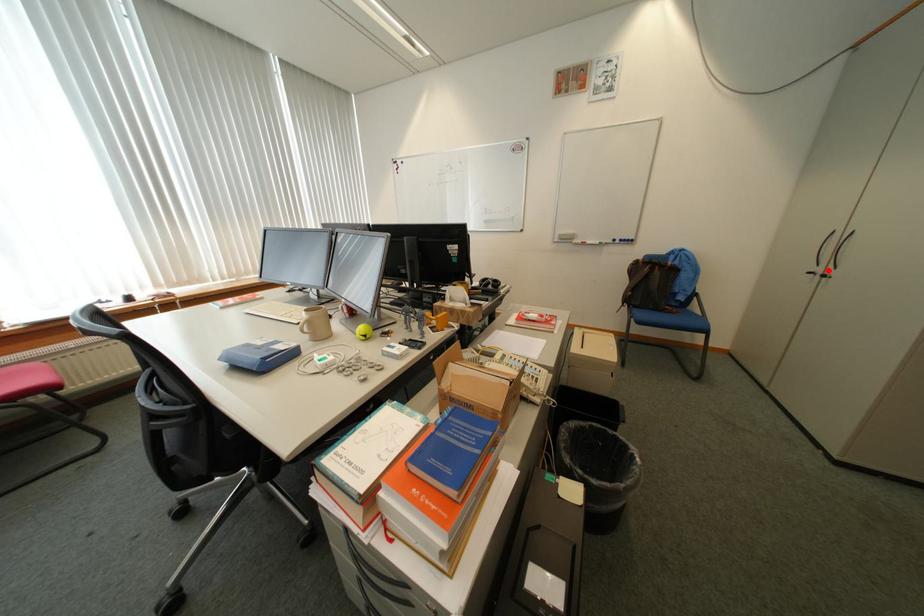
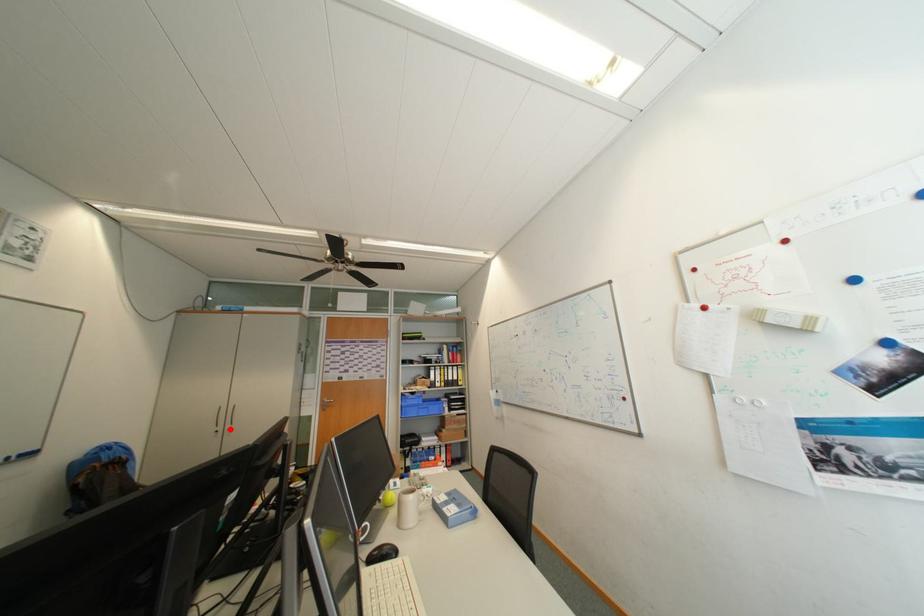
I am providing you with two images of the same scene from different viewpoints. A red point is marked on the first image and another point is marked on the second image. Does the point marked in image1 correspond to the same location as the one in image2?

Yes